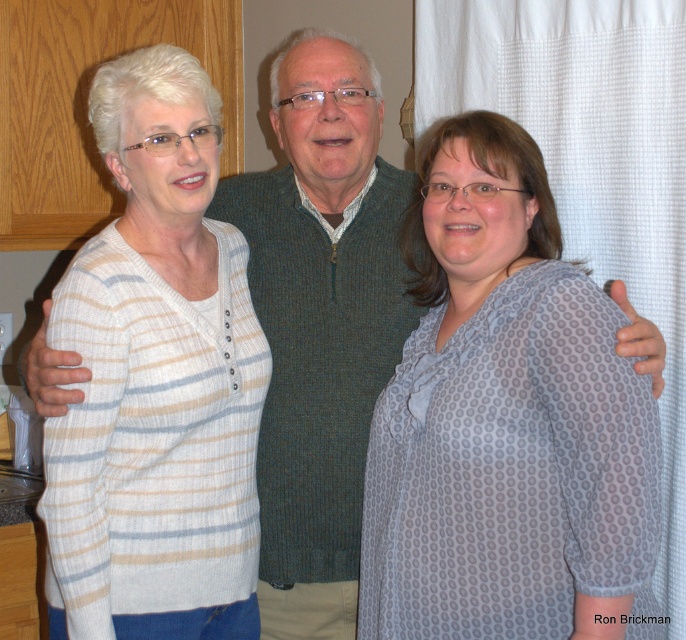
Looking at this image, you are organizing a photo album and want to place the gray dotted blouse at center and white striped sweater at left in a row based on their height. Which one should you place first?

The gray dotted blouse at center is shorter than the white striped sweater at left, so you should place the gray dotted blouse at center first if arranging from shortest to tallest.

Consider the image. You are a fashion designer observing three people in a living room. You need to determine which clothing item, the gray dotted blouse at center or the white striped sweater at left, requires more fabric to make. Based on the image, which one would you choose?

The gray dotted blouse at center is bigger than the white striped sweater at left, so it requires more fabric to make.

You are a photographer standing 10 feet away from the group. You want to take a photo of the gray dotted blouse at center and white striped sweater at left. Can you fit both of them in the frame if your camera has a 50mm lens with a field of view of 46 degrees?

The gray dotted blouse at center and white striped sweater at left are 16.49 inches apart. At 10 feet away, the 50mm lens with a 46 degree field of view can capture approximately 7.7 feet width. Since 16.49 inches is less than 7.7 feet, both can fit in the frame.